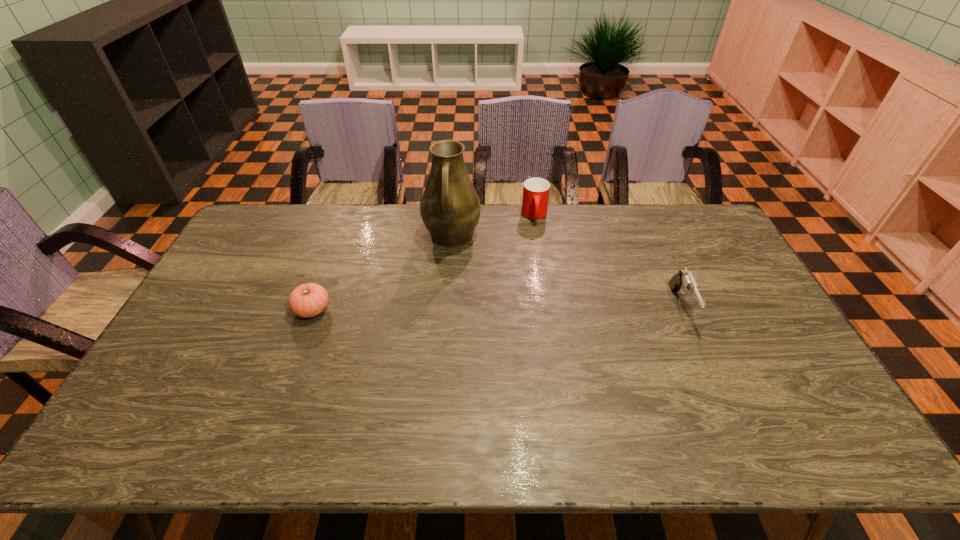
The image size is (960, 540). I want to click on vacant space at the far left corner, so click(x=271, y=207).

Image resolution: width=960 pixels, height=540 pixels. I want to click on vacant space at the far right corner of the desktop, so click(712, 224).

Identify the location of vacant area that lies between the gun and the leftmost object. Image resolution: width=960 pixels, height=540 pixels. coord(496,308).

Locate an element on the screen. This screenshot has height=540, width=960. vacant area that lies between the gun and the tallest object is located at coordinates (566, 272).

At what (x,y) coordinates should I click in order to perform the action: click on free point between the second object from right to left and the leftmost object. Please return your answer as a coordinate pair (x, y). The image size is (960, 540). Looking at the image, I should click on (423, 262).

You are a GUI agent. You are given a task and a screenshot of the screen. Output one action in this format:
    pyautogui.click(x=<x>, y=<y>)
    Task: Click on the free spot between the rightmost object and the pitcher
    
    Given the screenshot: What is the action you would take?
    pyautogui.click(x=566, y=272)

I want to click on vacant area that lies between the rightmost object and the tallest object, so click(x=566, y=272).

Locate an element on the screen. free area in between the pitcher and the gun is located at coordinates click(566, 272).

The width and height of the screenshot is (960, 540). In order to click on free spot between the gun and the third object from left to right in this screenshot , I will do `click(608, 261)`.

In order to click on vacant space in between the gun and the third object from left to right in this screenshot , I will do `click(608, 261)`.